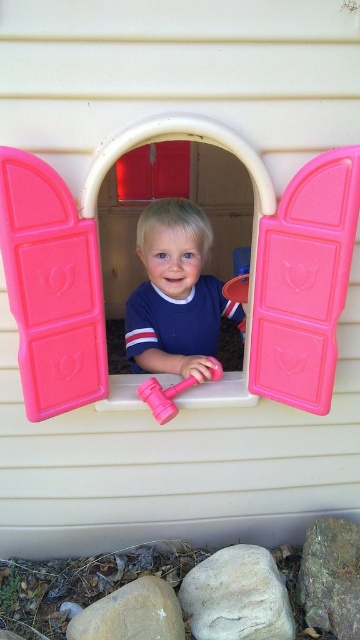
Which is more to the left, pink plastic hammer at center or pink rubber hammer at center?

Positioned to the left is pink plastic hammer at center.

How far apart are pink plastic hammer at center and pink rubber hammer at center?

They are 12.61 inches apart.

Is point (20, 305) more distant than point (164, 419)?

That is False.

The height and width of the screenshot is (640, 360). I want to click on pink plastic hammer at center, so click(249, 275).

Which of these two, pink plastic hammer at center or matte blue shirt at center, stands shorter?

Standing shorter between the two is matte blue shirt at center.

In order to click on pink plastic hammer at center in this screenshot , I will do `click(249, 275)`.

Image resolution: width=360 pixels, height=640 pixels. I want to click on pink plastic hammer at center, so click(249, 275).

In the scene shown: Can you confirm if matte blue shirt at center is positioned above pink rubber hammer at center?

Correct, matte blue shirt at center is located above pink rubber hammer at center.

Does matte blue shirt at center have a lesser width compared to pink rubber hammer at center?

No.

I want to click on matte blue shirt at center, so click(174, 292).